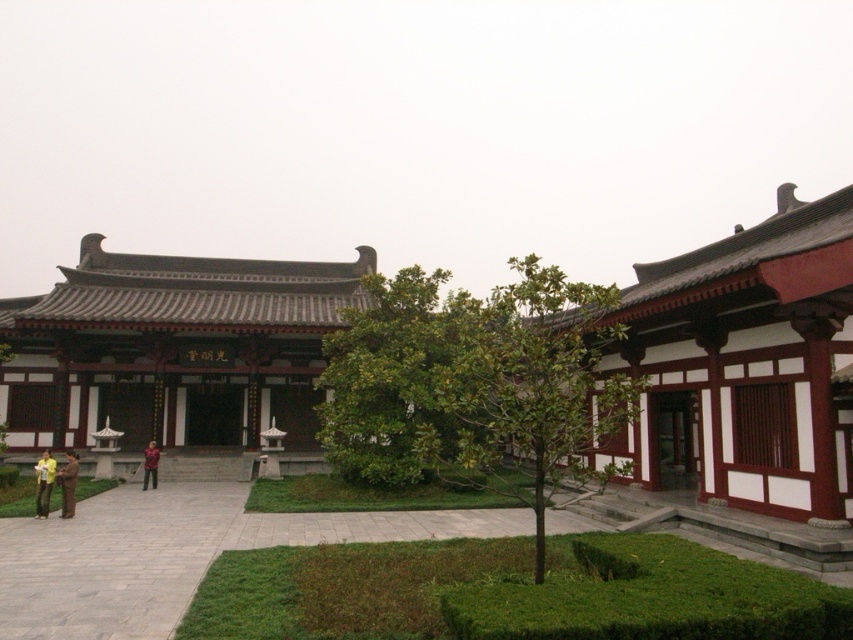
Who is lower down, white wood palace at right or gray stone path at center?

Positioned lower is gray stone path at center.

This screenshot has width=853, height=640. I want to click on white wood palace at right, so click(746, 385).

The image size is (853, 640). Find the location of `white wood palace at right`. white wood palace at right is located at coordinates (746, 385).

Can you confirm if yellow cotton shirt at lower left is positioned above red plaid shirt at center?

No.

Does yellow cotton shirt at lower left have a smaller size compared to red plaid shirt at center?

Incorrect, yellow cotton shirt at lower left is not smaller in size than red plaid shirt at center.

Locate an element on the screen. Image resolution: width=853 pixels, height=640 pixels. yellow cotton shirt at lower left is located at coordinates (44, 483).

Is point (668, 292) less distant than point (56, 476)?

Yes, point (668, 292) is in front of point (56, 476).

I want to click on white wood palace at right, so click(x=746, y=385).